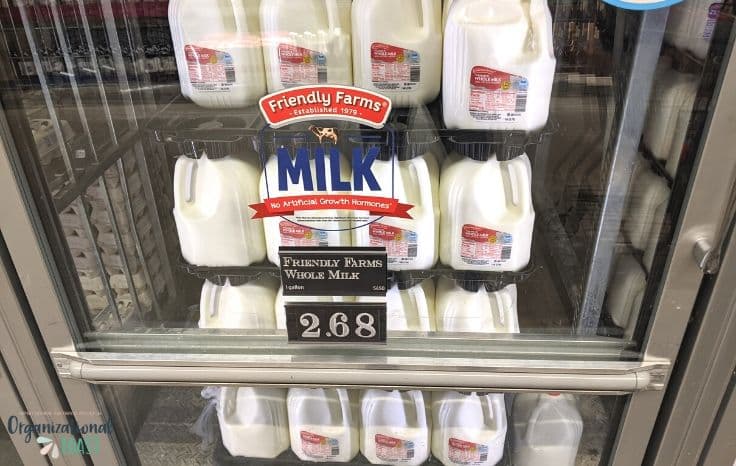
This screenshot has width=736, height=466. What are the coordinates of `milk on the second from the bottom shelf` in the screenshot? It's located at (233, 310), (282, 300), (397, 294), (456, 298).